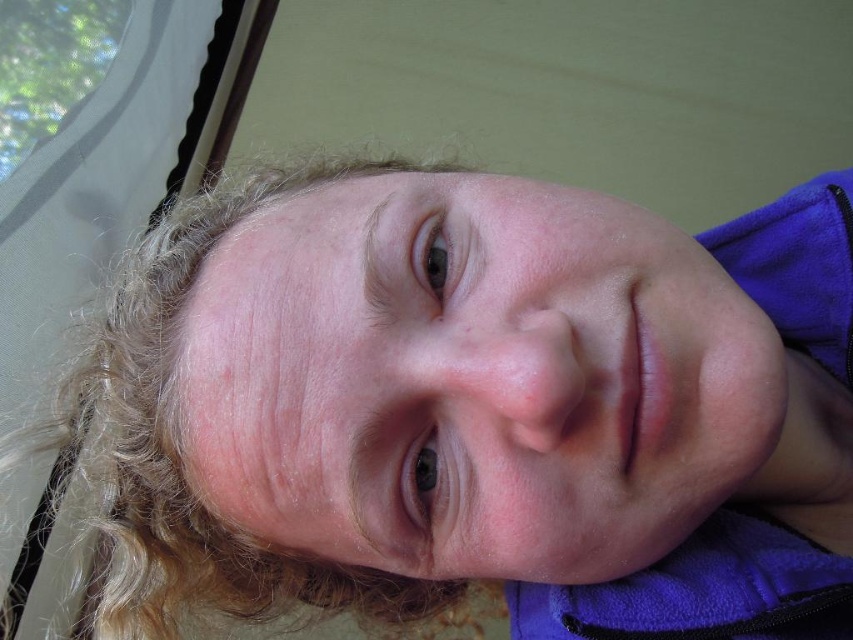
You are a photographer adjusting the focus on your camera. The subject has a smooth skin face at center and blonde curly hair at upper left. To ensure both are in focus, what should you consider about their distance?

The smooth skin face at center is 5.76 inches away from the blonde curly hair at upper left. Since they are relatively close in distance, adjusting the focus to a midrange setting should keep both in focus.

Based on the scene description, which object is smaller in size between the smooth skin face at center and the blonde curly hair at upper left?

The smooth skin face at center is smaller in size compared to the blonde curly hair at upper left according to the description.

You are an artist sketching this person. You want to draw the smooth skin face at center and the blonde curly hair at upper left. Which one should you draw first if you want to follow the natural left to right flow?

You should draw the blonde curly hair at upper left first because the smooth skin face at center is to the right of it, following the left to right flow.